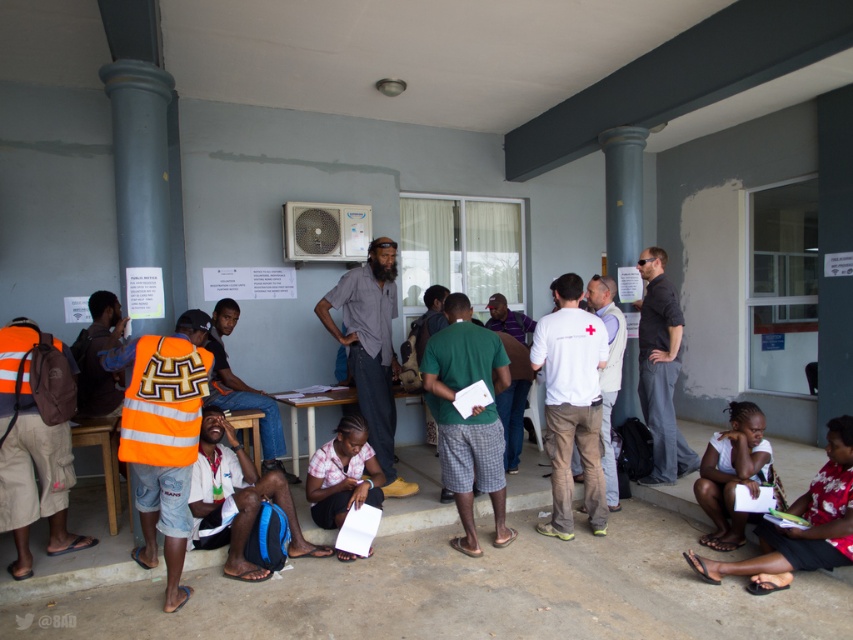
Who is lower down, green plaid shorts at center or white paper at lower right?

white paper at lower right

Who is shorter, green plaid shorts at center or white paper at lower right?

white paper at lower right is shorter.

Locate an element on the screen. green plaid shorts at center is located at coordinates (468, 417).

Is gray cotton shirt at center to the right of white paper at lower right from the viewer's perspective?

Incorrect, gray cotton shirt at center is not on the right side of white paper at lower right.

Which is more to the left, gray cotton shirt at center or white paper at lower right?

gray cotton shirt at center

Is point (329, 321) farther from camera compared to point (711, 576)?

Yes, it is behind point (711, 576).

Identify the location of gray cotton shirt at center. This screenshot has height=640, width=853. (370, 348).

Is point (846, 513) positioned after point (656, 460)?

No, it is in front of (656, 460).

Who is more forward, (845, 492) or (651, 388)?

Point (845, 492) is more forward.

This screenshot has height=640, width=853. In order to click on white paper at lower right in this screenshot , I will do `click(799, 529)`.